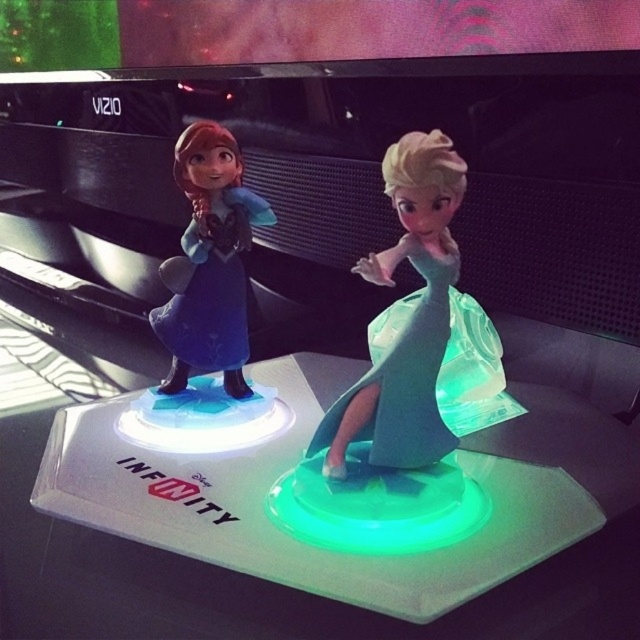
Question: Does translucent green dress at center have a smaller size compared to matte blue dress at left?

Choices:
 (A) no
 (B) yes

Answer: (B)

Question: Which point is farther to the camera?

Choices:
 (A) translucent green dress at center
 (B) matte blue dress at left

Answer: (B)

Question: Which point is closer to the camera?

Choices:
 (A) (227, 278)
 (B) (333, 410)

Answer: (B)

Question: From the image, what is the correct spatial relationship of translucent green dress at center in relation to matte blue dress at left?

Choices:
 (A) below
 (B) above

Answer: (A)

Question: Which object is farther from the camera taking this photo?

Choices:
 (A) matte blue dress at left
 (B) translucent green dress at center

Answer: (A)

Question: Can you confirm if translucent green dress at center is positioned above matte blue dress at left?

Choices:
 (A) yes
 (B) no

Answer: (B)